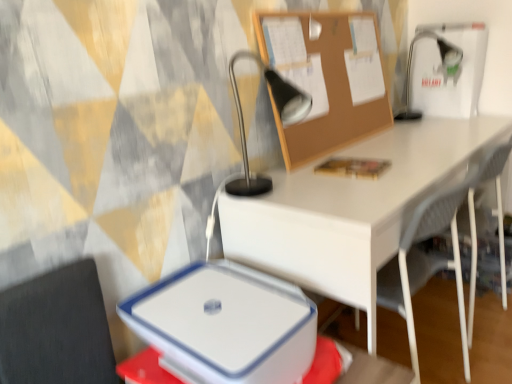
I want to click on empty space that is ontop of white plastic lunch box at lower center, so click(x=222, y=307).